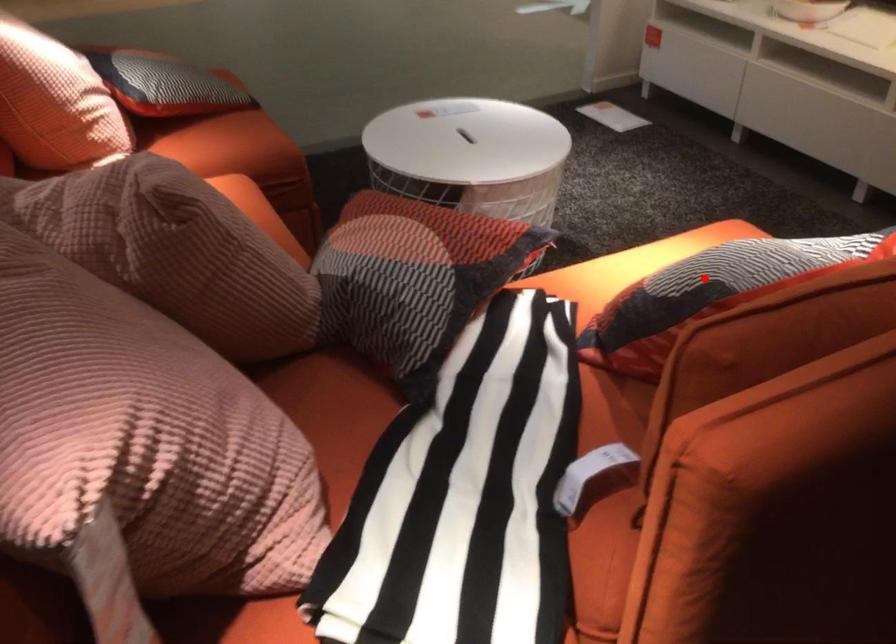
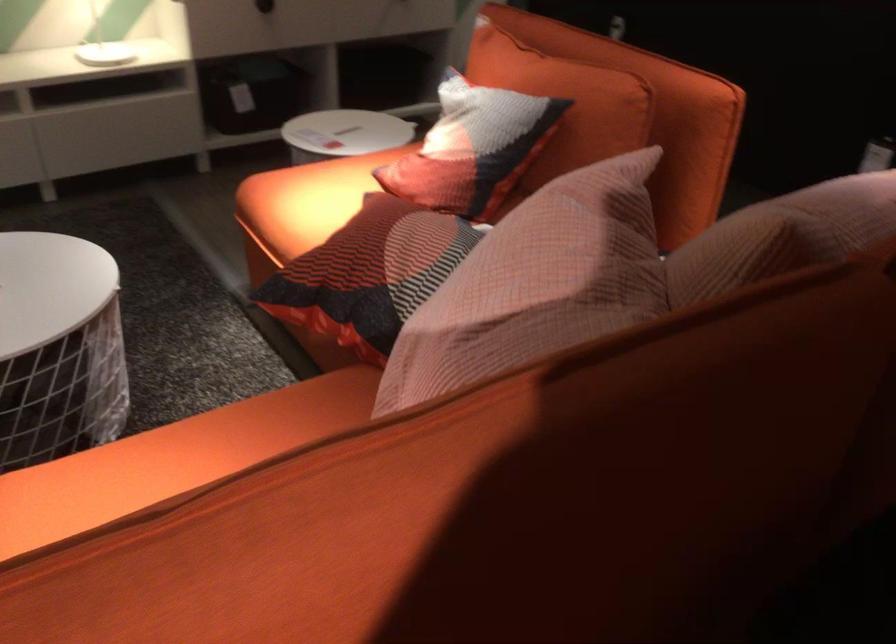
Question: I am providing you with two images of the same scene from different viewpoints. Image1 has a red point marked. In image2, the corresponding 3D location appears at what relative position? Reply with the corresponding letter.

Choices:
 (A) Closer
 (B) Farther

Answer: (B)